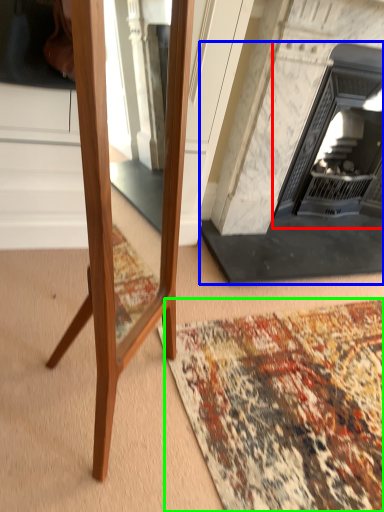
Question: Based on their relative distances, which object is farther from fireplace (highlighted by a red box)? Choose from fireplace (highlighted by a blue box) and mat (highlighted by a green box).

Choices:
 (A) fireplace
 (B) mat

Answer: (B)